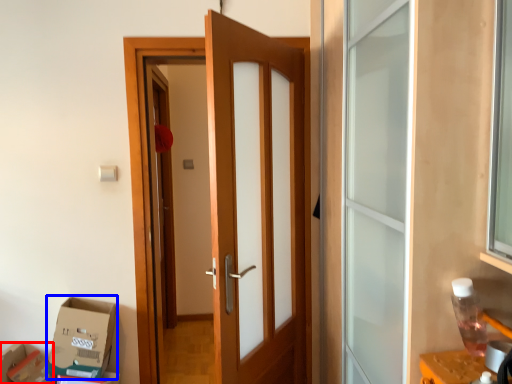
Question: Among these objects, which one is farthest to the camera, cardboard box (highlighted by a red box) or cardboard box (highlighted by a blue box)?

Choices:
 (A) cardboard box
 (B) cardboard box

Answer: (A)